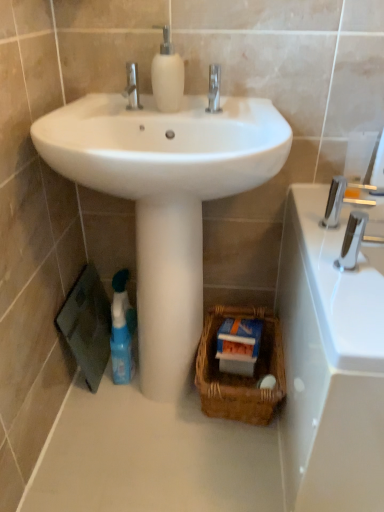
The width and height of the screenshot is (384, 512). What do you see at coordinates (164, 146) in the screenshot?
I see `white glossy sink at center` at bounding box center [164, 146].

Locate an element on the screen. This screenshot has height=512, width=384. white glossy sink at center is located at coordinates (164, 146).

Where is `silver metallic faucet at upper right`? Image resolution: width=384 pixels, height=512 pixels. silver metallic faucet at upper right is located at coordinates (340, 201).

Where is `polished chrome tap at right`? This screenshot has width=384, height=512. polished chrome tap at right is located at coordinates (355, 240).

This screenshot has height=512, width=384. What do you see at coordinates (167, 75) in the screenshot?
I see `white glossy soap dispenser at center` at bounding box center [167, 75].

This screenshot has height=512, width=384. I want to click on white glossy sink at center, so click(x=164, y=146).

In the scene shown: Who is taller, white glossy sink at center or silver metallic faucet at upper right?

white glossy sink at center is taller.

Considering the sizes of white glossy sink at center and silver metallic faucet at upper right in the image, is white glossy sink at center bigger or smaller than silver metallic faucet at upper right?

white glossy sink at center is bigger than silver metallic faucet at upper right.

Considering the relative sizes of white glossy sink at center and silver metallic faucet at upper right in the image provided, is white glossy sink at center thinner than silver metallic faucet at upper right?

No.

From a real-world perspective, is silver metallic faucet at upper right located higher than white glossy soap dispenser at center?

Actually, silver metallic faucet at upper right is physically below white glossy soap dispenser at center in the real world.

Is silver metallic faucet at upper right not close to white glossy soap dispenser at center?

No, there isn't a large distance between silver metallic faucet at upper right and white glossy soap dispenser at center.

Where is `soap dispenser above the silver metallic faucet at upper right (from the image's perspective)`? soap dispenser above the silver metallic faucet at upper right (from the image's perspective) is located at coordinates (167, 75).

Which of these two, silver metallic faucet at upper right or white glossy soap dispenser at center, is wider?

silver metallic faucet at upper right.

Considering the sizes of objects polished chrome tap at right and white glossy soap dispenser at center in the image provided, who is shorter, polished chrome tap at right or white glossy soap dispenser at center?

polished chrome tap at right.

From a real-world perspective, is polished chrome tap at right positioned above or below white glossy soap dispenser at center?

Clearly, from a real-world perspective, polished chrome tap at right is below white glossy soap dispenser at center.

Is point (360, 240) farther from camera compared to point (179, 94)?

No, (360, 240) is closer to viewer.

Based on the photo, considering the relative sizes of polished chrome tap at right and white glossy soap dispenser at center in the image provided, is polished chrome tap at right smaller than white glossy soap dispenser at center?

Incorrect, polished chrome tap at right is not smaller in size than white glossy soap dispenser at center.

Can you tell me how much blue glossy bottle at lower left and brown woven basket at lower center differ in facing direction?

They differ by 0.625 degrees in their facing directions.

Locate an element on the screen. basket in front of the blue glossy bottle at lower left is located at coordinates (240, 375).

From the image's perspective, is blue glossy bottle at lower left under brown woven basket at lower center?

No, from the image's perspective, blue glossy bottle at lower left is not beneath brown woven basket at lower center.

Which is further, (128, 322) or (267, 315)?

The point (128, 322) is more distant.

From the picture: Is white glossy sink at center positioned far away from blue glossy bottle at lower left?

No, there isn't a large distance between white glossy sink at center and blue glossy bottle at lower left.

Locate an element on the screen. This screenshot has width=384, height=512. sink on the right of blue glossy bottle at lower left is located at coordinates (164, 146).

Is point (216, 165) positioned behind point (125, 350)?

No, it is in front of (125, 350).

Is point (170, 253) closer to viewer compared to point (172, 59)?

No.

Between white smooth pedestal at center and white glossy soap dispenser at center, which one has more height?

white smooth pedestal at center.

Is white glossy soap dispenser at center surrounded by white smooth pedestal at center?

No.

From the image's perspective, which object appears higher, white smooth pedestal at center or white glossy soap dispenser at center?

white glossy soap dispenser at center appears higher in the image.

From a real-world perspective, is white glossy sink at center positioned above or below polished chrome tap at right?

In terms of real-world spatial position, white glossy sink at center is above polished chrome tap at right.

Considering the sizes of objects white glossy sink at center and polished chrome tap at right in the image provided, who is taller, white glossy sink at center or polished chrome tap at right?

white glossy sink at center is taller.

Does white glossy sink at center lie in front of polished chrome tap at right?

Yes, white glossy sink at center is closer to the viewer.

From the image's perspective, is white glossy sink at center beneath polished chrome tap at right?

Actually, white glossy sink at center appears above polished chrome tap at right in the image.

Locate an element on the screen. plumbing fixture below the white glossy sink at center (from the image's perspective) is located at coordinates (340, 201).

Where is `plumbing fixture in front of the white glossy soap dispenser at center`? The height and width of the screenshot is (512, 384). plumbing fixture in front of the white glossy soap dispenser at center is located at coordinates (x=340, y=201).

Considering their positions, is blue glossy bottle at lower left positioned closer to white glossy sink at center than brown woven basket at lower center?

blue glossy bottle at lower left lies closer to white glossy sink at center than the other object.

Considering their positions, is white glossy soap dispenser at center positioned further to silver metallic faucet at upper right than polished chrome tap at right?

white glossy soap dispenser at center.

Considering their positions, is white glossy soap dispenser at center positioned further to white smooth pedestal at center than white glossy sink at center?

Based on the image, white glossy soap dispenser at center appears to be further to white smooth pedestal at center.

Which object lies further to the anchor point polished chrome tap at right, white smooth pedestal at center or brown woven basket at lower center?

The object further to polished chrome tap at right is brown woven basket at lower center.

When comparing their distances from white smooth pedestal at center, does brown woven basket at lower center or white glossy soap dispenser at center seem further?

white glossy soap dispenser at center is positioned further to the anchor white smooth pedestal at center.

Which object lies nearer to the anchor point silver metallic faucet at upper right, white glossy soap dispenser at center or white glossy sink at center?

white glossy sink at center.

Which object lies nearer to the anchor point white smooth pedestal at center, brown woven basket at lower center or polished chrome tap at right?

brown woven basket at lower center.

When comparing their distances from brown woven basket at lower center, does white glossy soap dispenser at center or white smooth pedestal at center seem further?

The object further to brown woven basket at lower center is white glossy soap dispenser at center.

The height and width of the screenshot is (512, 384). I want to click on tap located between white glossy soap dispenser at center and silver metallic faucet at upper right in the left-right direction, so click(355, 240).

The height and width of the screenshot is (512, 384). In order to click on tap between white glossy soap dispenser at center and white smooth pedestal at center in the up-down direction in this screenshot , I will do `click(355, 240)`.

Locate an element on the screen. This screenshot has height=512, width=384. pillar between white glossy sink at center and brown woven basket at lower center vertically is located at coordinates (168, 292).

This screenshot has width=384, height=512. Find the location of `basket located between white smooth pedestal at center and polished chrome tap at right in the left-right direction`. basket located between white smooth pedestal at center and polished chrome tap at right in the left-right direction is located at coordinates (240, 375).